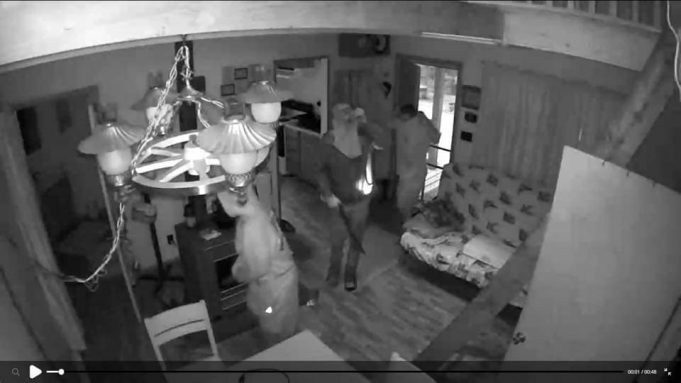
Identify the location of ladder. This screenshot has height=383, width=681. (492, 293).